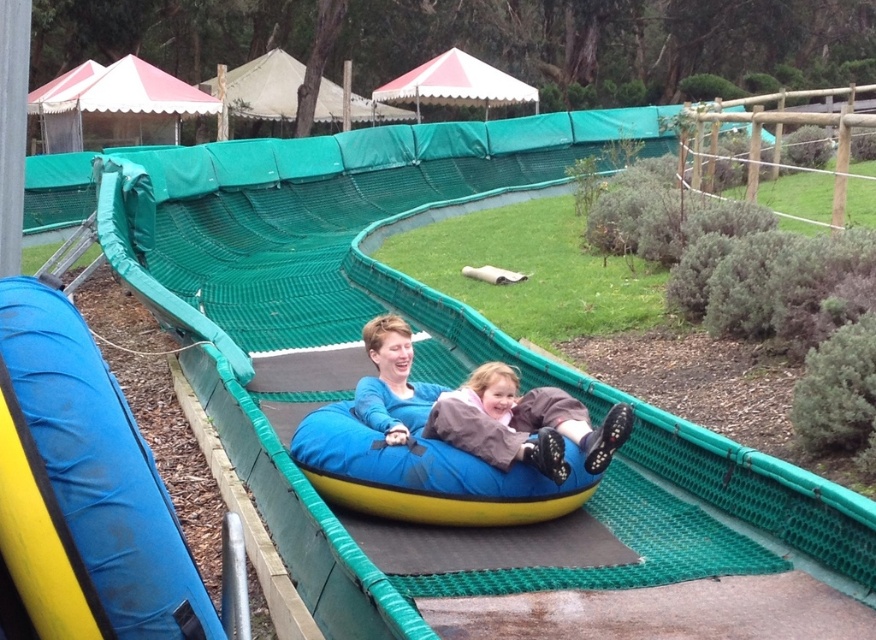
Question: From the image, what is the correct spatial relationship of brown fuzzy pants at center in relation to blue matte sweater at center?

Choices:
 (A) above
 (B) below

Answer: (B)

Question: Can you confirm if blue rubber tube at center is wider than blue matte sweater at center?

Choices:
 (A) yes
 (B) no

Answer: (A)

Question: Based on their relative distances, which object is nearer to the blue rubber tube at center?

Choices:
 (A) blue matte sweater at center
 (B) blue rubber slide at center
 (C) brown fuzzy pants at center

Answer: (C)

Question: Is blue rubber slide at center closer to camera compared to blue rubber tube at center?

Choices:
 (A) no
 (B) yes

Answer: (B)

Question: Which object is closer to the camera taking this photo?

Choices:
 (A) blue rubber slide at center
 (B) blue matte sweater at center

Answer: (A)

Question: Based on their relative distances, which object is nearer to the blue rubber slide at center?

Choices:
 (A) blue rubber tube at center
 (B) brown fuzzy pants at center

Answer: (A)